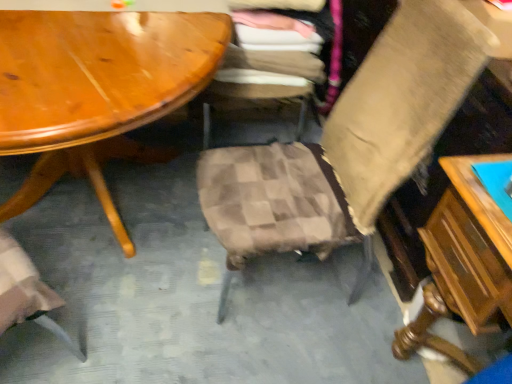
Question: Does plaid fabric chair at center, which is the second chair from right to left, appear on the left side of wooden table at right?

Choices:
 (A) yes
 (B) no

Answer: (A)

Question: Considering the relative sizes of plaid fabric chair at center, which is counted as the first chair, starting from the left, and wooden table at right in the image provided, is plaid fabric chair at center, which is counted as the first chair, starting from the left, taller than wooden table at right?

Choices:
 (A) no
 (B) yes

Answer: (B)

Question: Can you see plaid fabric chair at center, which is the second chair from right to left, touching wooden table at right?

Choices:
 (A) yes
 (B) no

Answer: (B)

Question: From the image's perspective, is plaid fabric chair at center, which is the second chair from right to left, under wooden table at right?

Choices:
 (A) yes
 (B) no

Answer: (B)

Question: From the image's perspective, is plaid fabric chair at center, which is counted as the first chair, starting from the left, located above wooden table at right?

Choices:
 (A) no
 (B) yes

Answer: (B)

Question: From a real-world perspective, is plaid fabric chair at center, which is the second chair from right to left, under wooden table at right?

Choices:
 (A) no
 (B) yes

Answer: (A)

Question: Can you confirm if beige fabric chair at center, the first chair viewed from the right, is smaller than wooden table at right?

Choices:
 (A) no
 (B) yes

Answer: (A)

Question: Does beige fabric chair at center, the first chair viewed from the right, appear on the left side of wooden table at right?

Choices:
 (A) no
 (B) yes

Answer: (B)

Question: From a real-world perspective, is beige fabric chair at center, marked as the 2th chair in a left-to-right arrangement, positioned over wooden table at right based on gravity?

Choices:
 (A) yes
 (B) no

Answer: (A)

Question: Can you confirm if beige fabric chair at center, marked as the 2th chair in a left-to-right arrangement, is positioned to the right of wooden table at right?

Choices:
 (A) yes
 (B) no

Answer: (B)

Question: Does beige fabric chair at center, marked as the 2th chair in a left-to-right arrangement, turn towards wooden table at right?

Choices:
 (A) yes
 (B) no

Answer: (B)

Question: Considering the relative sizes of beige fabric chair at center, the first chair viewed from the right, and wooden table at right in the image provided, is beige fabric chair at center, the first chair viewed from the right, shorter than wooden table at right?

Choices:
 (A) yes
 (B) no

Answer: (B)

Question: Could you tell me if wooden table at right is facing plaid fabric chair at center, which is the second chair from right to left?

Choices:
 (A) no
 (B) yes

Answer: (A)